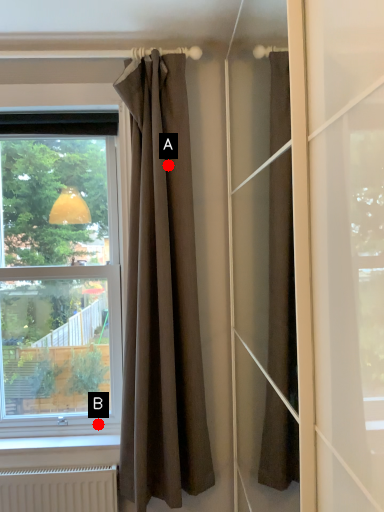
Question: Two points are circled on the image, labeled by A and B beside each circle. Which of the following is the farthest from the observer?

Choices:
 (A) A is further
 (B) B is further

Answer: (B)